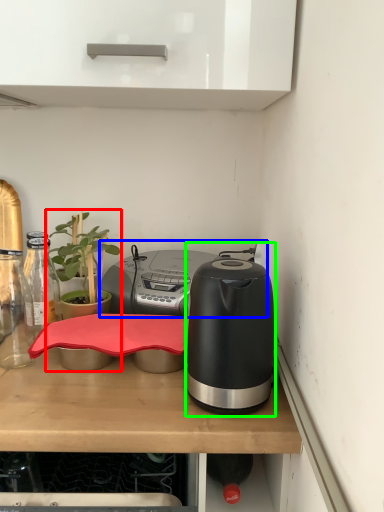
Question: Which object is the closest to the houseplant (highlighted by a red box)? Choose among these: appliance (highlighted by a blue box) or kitchen appliance (highlighted by a green box).

Choices:
 (A) appliance
 (B) kitchen appliance

Answer: (A)